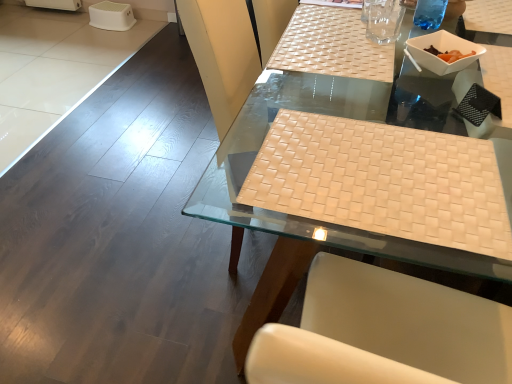
You are a GUI agent. You are given a task and a screenshot of the screen. Output one action in this format:
    pyautogui.click(x=<x>, y=<y>)
    Task: Click on the free spot above beige woven mat at center (from a real-world perspective)
    
    Given the screenshot: What is the action you would take?
    pyautogui.click(x=377, y=170)